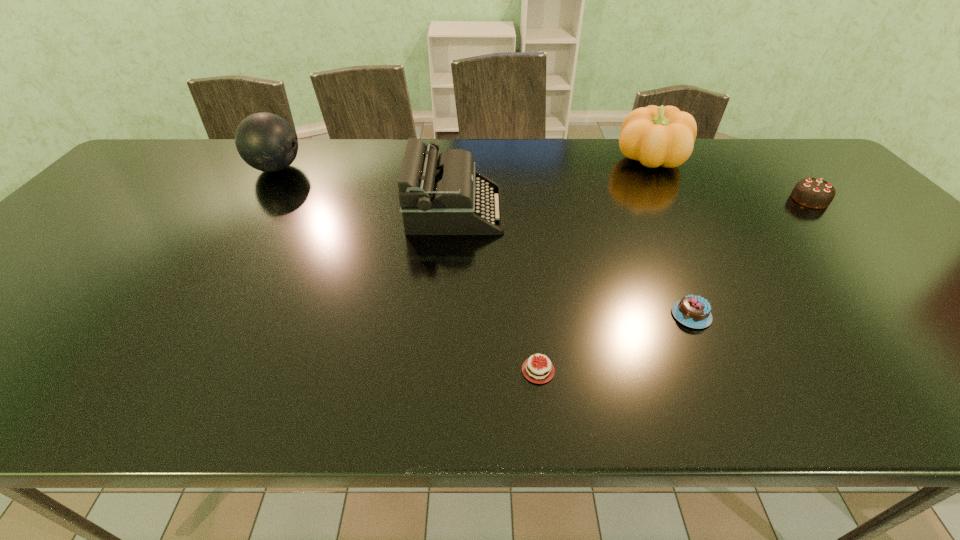
The width and height of the screenshot is (960, 540). I want to click on vacant space at the near edge of the desktop, so click(641, 402).

Identify the location of free space at the left edge of the desktop. (8, 305).

The width and height of the screenshot is (960, 540). In the image, there is a desktop. Find the location of `free space at the right edge`. free space at the right edge is located at coordinates (891, 263).

You are a GUI agent. You are given a task and a screenshot of the screen. Output one action in this format:
    pyautogui.click(x=<x>, y=<y>)
    Task: Click on the blank region between the typewriter and the farthest chocolate cake
    The width and height of the screenshot is (960, 540).
    Given the screenshot: What is the action you would take?
    pyautogui.click(x=633, y=205)

Find the location of `vacant area that lies between the bowling ball and the third shortest object`. vacant area that lies between the bowling ball and the third shortest object is located at coordinates (543, 184).

Identify the location of free spot between the typewriter and the leftmost object. The image size is (960, 540). (366, 189).

Identify the location of free space between the farthest chocolate cake and the second chocolate cake from left to right. Image resolution: width=960 pixels, height=540 pixels. (751, 257).

In order to click on vacant area between the rightmost object and the leftmost chocolate cake in this screenshot , I will do `click(674, 285)`.

You are a GUI agent. You are given a task and a screenshot of the screen. Output one action in this format:
    pyautogui.click(x=<x>, y=<y>)
    Task: Click on the vacant space that's between the pumpkin and the rightmost object
    
    Given the screenshot: What is the action you would take?
    pyautogui.click(x=730, y=180)

At what (x,y) coordinates should I click in order to perform the action: click on vacant space that's between the fifth tallest object and the bowling ball. Please return your answer as a coordinate pair (x, y). Looking at the image, I should click on (484, 242).